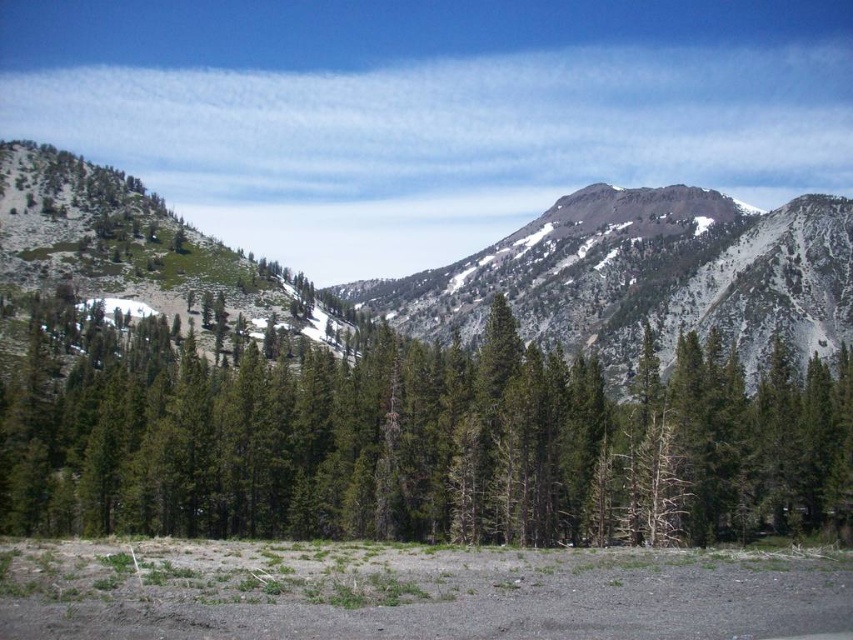
Between green matte tree at center and green textured mountain at center, which one is positioned higher?

green textured mountain at center is above.

Is green matte tree at center below green textured mountain at center?

Yes.

Who is more forward, (x=68, y=408) or (x=148, y=221)?

Point (x=68, y=408) is more forward.

Identify the location of green matte tree at center. (415, 442).